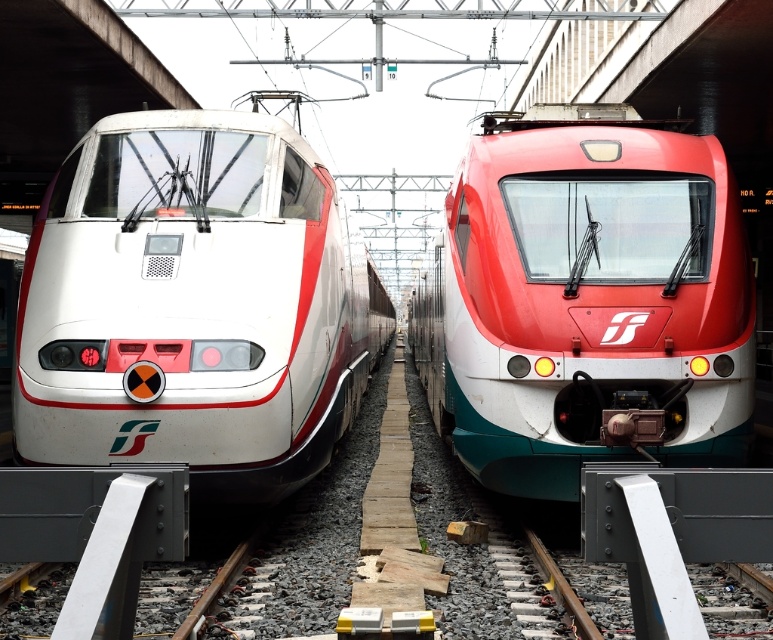
Who is positioned more to the right, white glossy train at left or matte red train at center?

matte red train at center

Which is behind, point (193, 221) or point (673, 433)?

The point (193, 221) is behind.

The height and width of the screenshot is (640, 773). Identify the location of white glossy train at left. (193, 305).